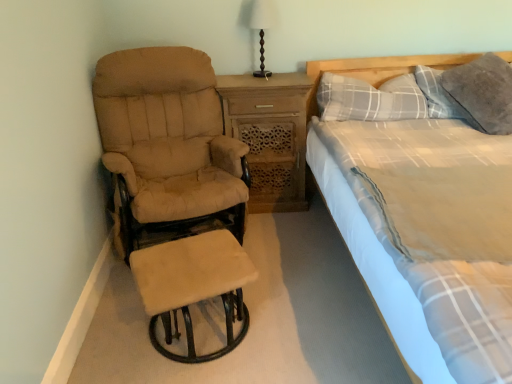
Question: From a real-world perspective, is matte brown wooden lamp at upper center over beige fabric recliner at left?

Choices:
 (A) no
 (B) yes

Answer: (B)

Question: Does matte brown wooden lamp at upper center touch beige fabric recliner at left?

Choices:
 (A) no
 (B) yes

Answer: (A)

Question: Could you tell me if matte brown wooden lamp at upper center is facing beige fabric recliner at left?

Choices:
 (A) no
 (B) yes

Answer: (A)

Question: Are matte brown wooden lamp at upper center and beige fabric recliner at left located far from each other?

Choices:
 (A) no
 (B) yes

Answer: (A)

Question: Considering the relative positions of matte brown wooden lamp at upper center and beige fabric recliner at left in the image provided, is matte brown wooden lamp at upper center in front of beige fabric recliner at left?

Choices:
 (A) yes
 (B) no

Answer: (B)

Question: Visually, is beige fabric recliner at left positioned to the left or to the right of light gray plaid fabric bed at right?

Choices:
 (A) right
 (B) left

Answer: (B)

Question: Is beige fabric recliner at left wider or thinner than light gray plaid fabric bed at right?

Choices:
 (A) wide
 (B) thin

Answer: (B)

Question: From their relative heights in the image, would you say beige fabric recliner at left is taller or shorter than light gray plaid fabric bed at right?

Choices:
 (A) short
 (B) tall

Answer: (B)

Question: Is beige fabric recliner at left in front of or behind light gray plaid fabric bed at right in the image?

Choices:
 (A) front
 (B) behind

Answer: (B)

Question: Is point (150, 332) closer or farther from the camera than point (414, 99)?

Choices:
 (A) closer
 (B) farther

Answer: (A)

Question: From their relative heights in the image, would you say beige suede stool at lower left is taller or shorter than gray plaid pillow at upper right, the 2th pillow viewed from the right?

Choices:
 (A) short
 (B) tall

Answer: (B)

Question: Considering the positions of beige suede stool at lower left and gray plaid pillow at upper right, the 2th pillow viewed from the right, in the image, is beige suede stool at lower left bigger or smaller than gray plaid pillow at upper right, the 2th pillow viewed from the right,?

Choices:
 (A) small
 (B) big

Answer: (B)

Question: In the image, is beige suede stool at lower left positioned in front of or behind gray plaid pillow at upper right, the 2th pillow viewed from the right?

Choices:
 (A) front
 (B) behind

Answer: (A)

Question: Is beige fabric recliner at left to the left or to the right of matte brown wooden lamp at upper center in the image?

Choices:
 (A) left
 (B) right

Answer: (A)

Question: Does point (237, 294) appear closer or farther from the camera than point (263, 13)?

Choices:
 (A) farther
 (B) closer

Answer: (B)